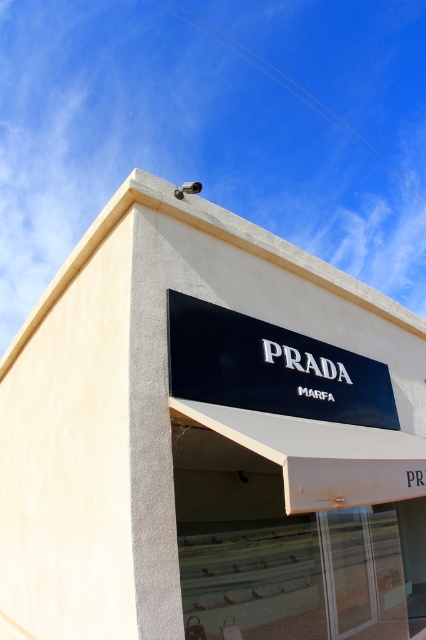
You are a graphic designer evaluating two signs for a new store. The black matte sign at center and the black glossy sign at center are both options. Based on the image, which sign is narrower in width?

The black matte sign at center is thinner than the black glossy sign at center, so the black matte sign at center is narrower in width.

You are standing at the entrance of the building and want to take a photo of the Prada Marfa sign. The camera you are using has a focal length of 50mm and a sensor size of 24mm x 36mm. If the point at coordinates point (x=368, y=396) is part of the sign and is 5.75 meters away from the camera, what is the approximate angle of view required to capture the entire sign in the photo?

The point at coordinates point (x=368, y=396) is 5.75 meters away from the camera. To calculate the angle of view, use the formula angle of view in radians equals 2 times the arctangent of half the sensor dimension divided by the focal length. The sensor size is 24mm x 36mm, so the diagonal is sqrt24 squared plus 36 squared equals sqrt24 squared plus 36 squared equals sqrt576 plus 1296 equals sqrt1872 equals approximately 43.27mm. Half of that is 21.635mm. Divide by focal length 50mm gives 0.4327. Arctangent

You are standing at the entrance of the building and want to place a new sign that is 2 meters wide between the black matte sign at center and the building entrance. Is there enough space to fit the new sign without overlapping either the existing sign or the entrance?

The distance between the black matte sign at center and the building entrance is 5.49 meters. Since the new sign is 2 meters wide, there is sufficient space to place it between them without overlapping.